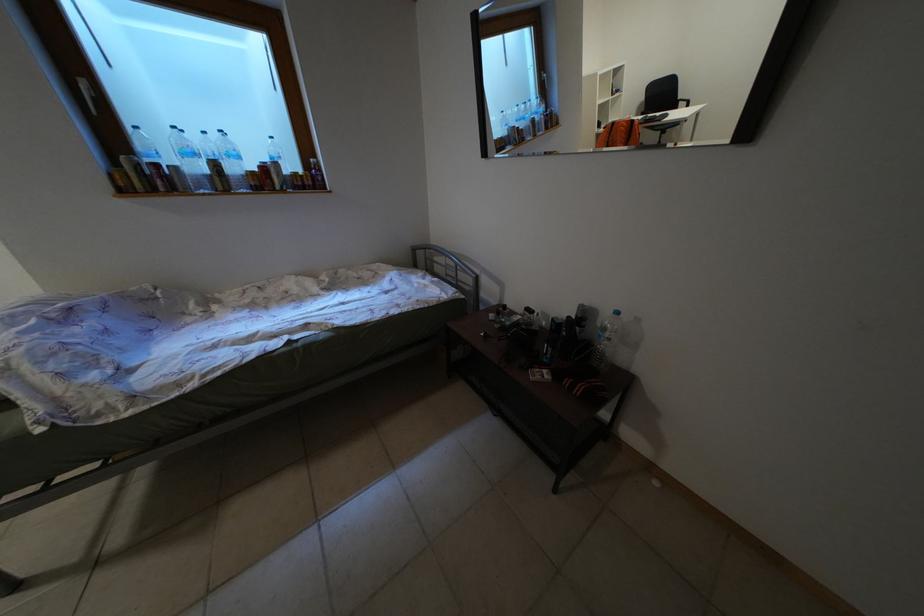
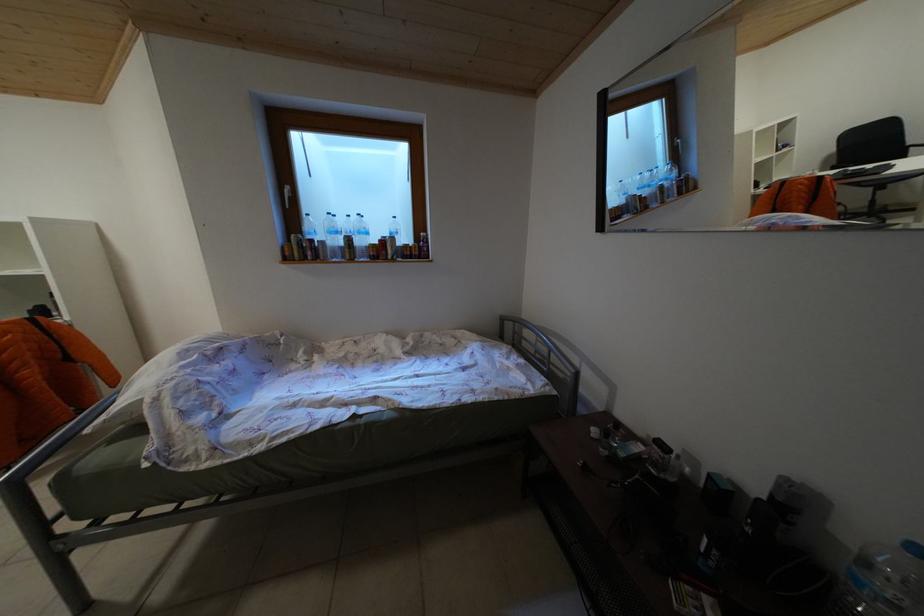
Question: Which direction would the cameraman need to move to produce the second image? Reply with the corresponding letter.

Choices:
 (A) Left
 (B) Right
 (C) Forward
 (D) Backward

Answer: (C)